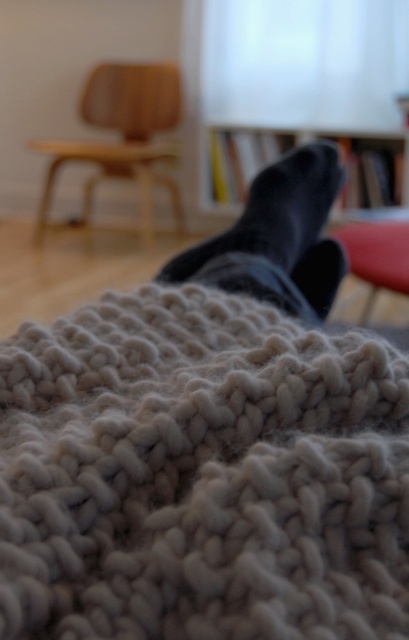
Question: Which point appears farthest from the camera in this image?

Choices:
 (A) (393, 282)
 (B) (310, 451)

Answer: (A)

Question: Does fuzzy woolen blanket at lower center lie behind wooden armchair at upper left?

Choices:
 (A) yes
 (B) no

Answer: (B)

Question: Among these objects, which one is farthest from the camera?

Choices:
 (A) wooden armchair at upper left
 (B) wooden bookshelf at center

Answer: (A)

Question: Among these points, which one is nearest to the camera?

Choices:
 (A) (289, 196)
 (B) (334, 209)
 (C) (253, 314)
 (D) (148, 236)

Answer: (C)

Question: Does wooden armchair at upper left appear on the right side of smooth red chair at center?

Choices:
 (A) yes
 (B) no

Answer: (B)

Question: Is fuzzy woolen blanket at lower center to the left of wooden armchair at upper left from the viewer's perspective?

Choices:
 (A) yes
 (B) no

Answer: (B)